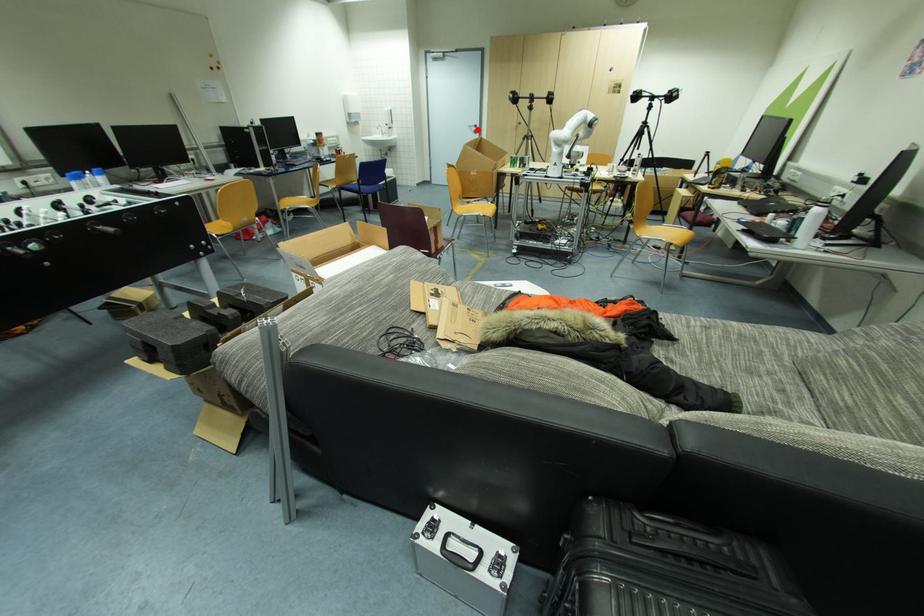
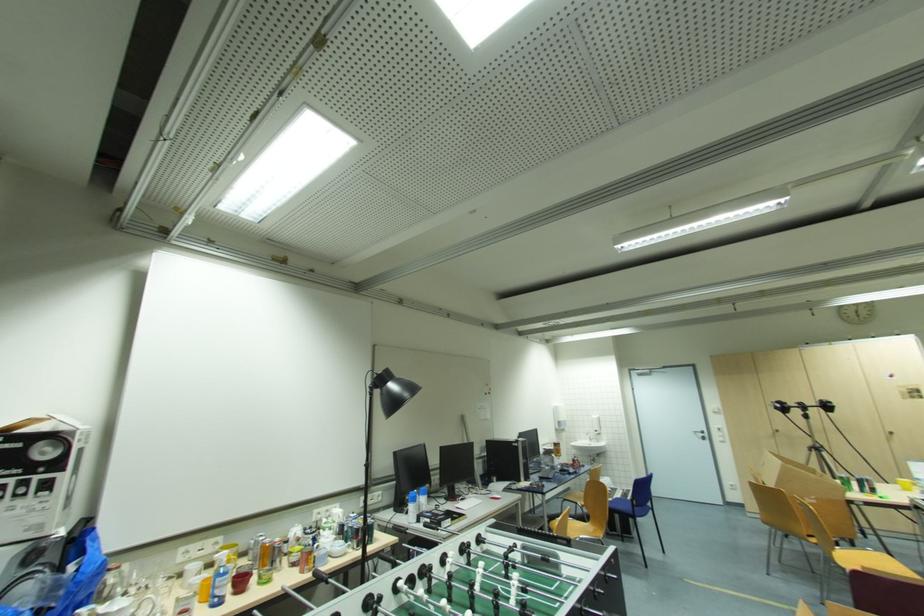
In the second image, find the point that corresponds to the highlighted location in the first image.

(706, 436)